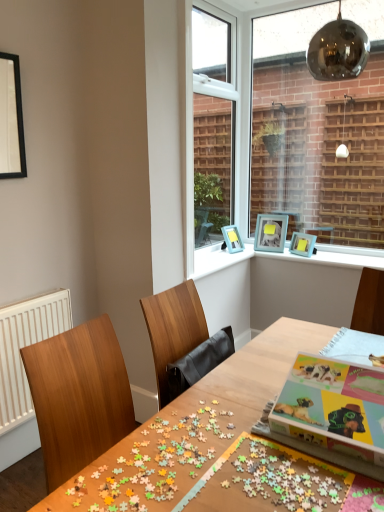
Question: From the image's perspective, is teal matte picture frame at upper right, the 1th picture frame from the back, positioned above or below black matte picture frame at upper left, which is counted as the first picture frame, starting from the left?

Choices:
 (A) below
 (B) above

Answer: (A)

Question: From their relative heights in the image, would you say teal matte picture frame at upper right, the 1th picture frame from the back, is taller or shorter than black matte picture frame at upper left, the fourth picture frame positioned from the right?

Choices:
 (A) short
 (B) tall

Answer: (A)

Question: Which of these objects is positioned farthest from the teal matte picture frame at upper right, which ranks as the second picture frame in left-to-right order?

Choices:
 (A) white plastic window frame at upper center
 (B) blue plastic picture frame at upper right, the 2th picture frame viewed from the front
 (C) white radiator at left
 (D) black matte picture frame at upper left, which is the 1th picture frame from front to back
 (E) multicolored cardboard jigsaw puzzle at center

Answer: (E)

Question: Which is nearer to the teal matte picture frame at upper right, which appears as the second picture frame when viewed from the right?

Choices:
 (A) white radiator at left
 (B) multicolored puzzle pieces at center
 (C) blue plastic picture frames at upper center
 (D) white plastic window frame at upper center
 (E) wooden table at center

Answer: (C)